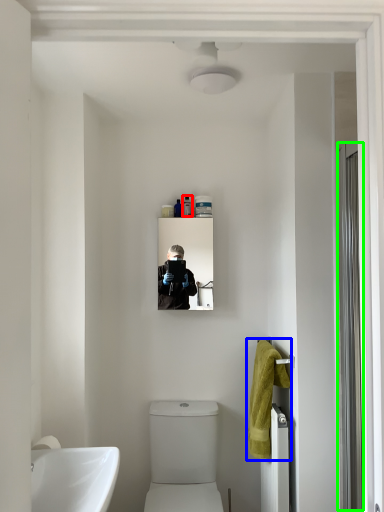
Question: Which is nearer to the toiletry (highlighted by a red box)? bath towel (highlighted by a blue box) or screen door (highlighted by a green box).

Choices:
 (A) bath towel
 (B) screen door

Answer: (A)